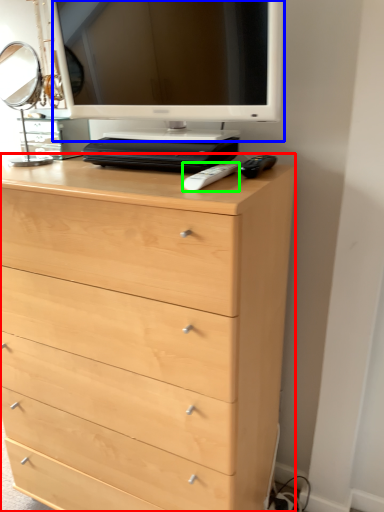
Question: Estimate the real-world distances between objects in this image. Which object is farther from chest of drawers (highlighted by a red box), computer monitor (highlighted by a blue box) or remote (highlighted by a green box)?

Choices:
 (A) computer monitor
 (B) remote

Answer: (B)